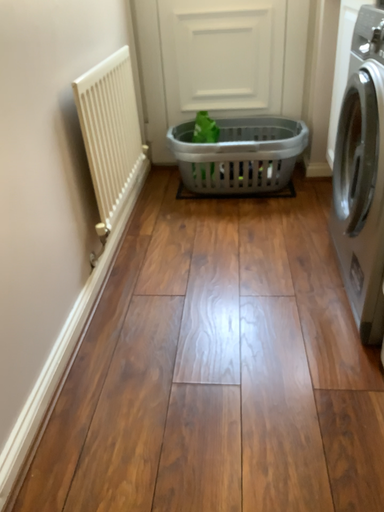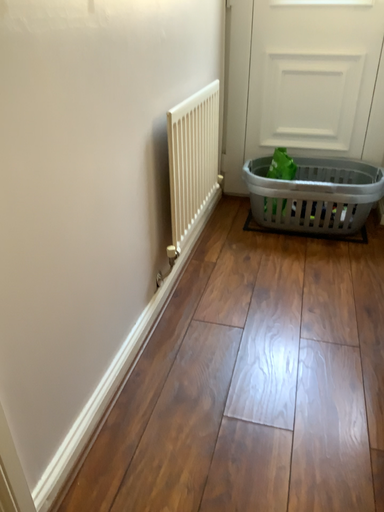
Question: Which way did the camera rotate in the video?

Choices:
 (A) rotated left
 (B) rotated right

Answer: (A)